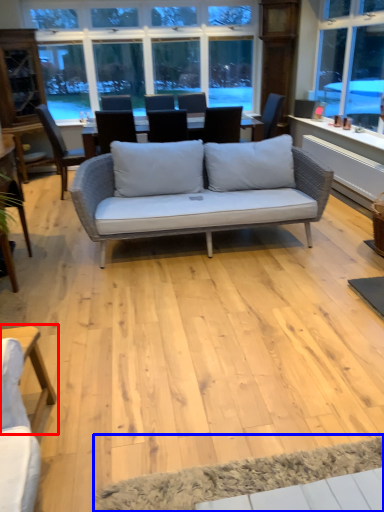
Question: Which object appears closest to the camera in this image, table (highlighted by a red box) or yoga mat (highlighted by a blue box)?

Choices:
 (A) table
 (B) yoga mat

Answer: (B)